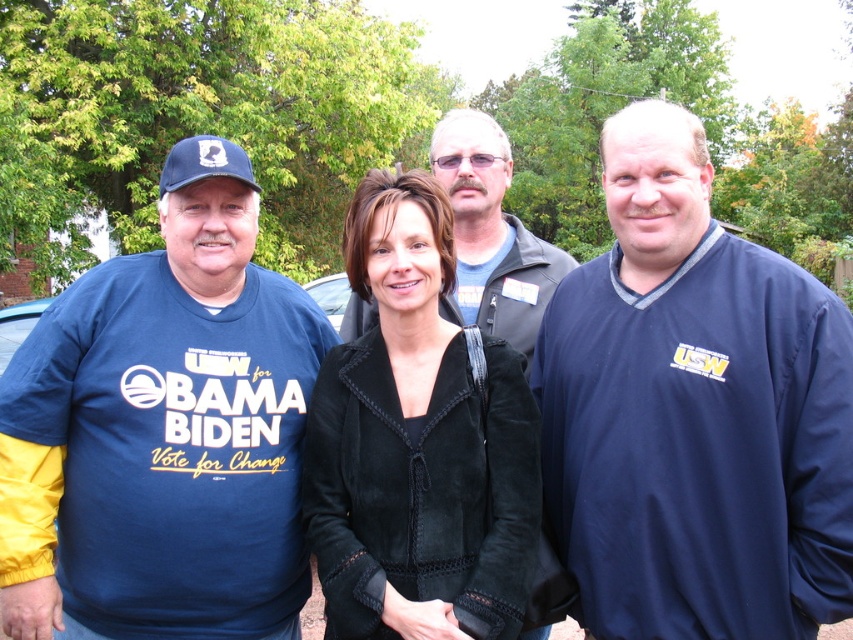
Question: Which of the following is the closest to the observer?

Choices:
 (A) navy blue sweater at right
 (B) velvet black jacket at center
 (C) blue fabric t-shirt at left
 (D) dark blue jacket at center

Answer: (A)

Question: Considering the relative positions of blue fabric t-shirt at left and velvet black jacket at center in the image provided, where is blue fabric t-shirt at left located with respect to velvet black jacket at center?

Choices:
 (A) left
 (B) right

Answer: (A)

Question: Which point is closer to the camera taking this photo?

Choices:
 (A) (235, 220)
 (B) (573, 413)
 (C) (502, 150)

Answer: (B)

Question: Does blue fabric t-shirt at left appear under dark blue jacket at center?

Choices:
 (A) yes
 (B) no

Answer: (A)

Question: Can you confirm if blue fabric t-shirt at left is smaller than dark blue jacket at center?

Choices:
 (A) no
 (B) yes

Answer: (A)

Question: Which object is the closest to the dark blue jacket at center?

Choices:
 (A) blue fabric t-shirt at left
 (B) velvet black jacket at center

Answer: (B)